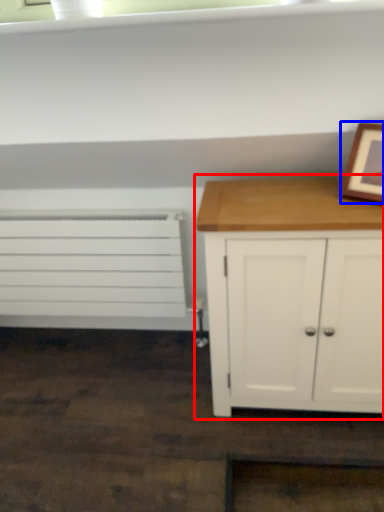
Question: Which object appears closest to the camera in this image, chest of drawers (highlighted by a red box) or picture frame (highlighted by a blue box)?

Choices:
 (A) chest of drawers
 (B) picture frame

Answer: (B)